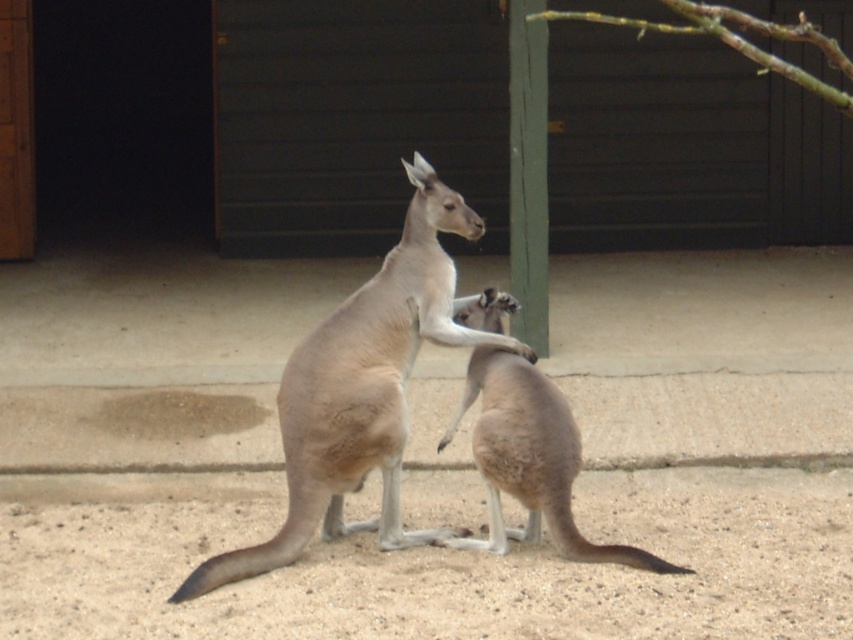
Question: Can you confirm if light brown fur at center is positioned to the right of green wood pole at center?

Choices:
 (A) yes
 (B) no

Answer: (B)

Question: Among these points, which one is nearest to the camera?

Choices:
 (A) (544, 51)
 (B) (287, 394)

Answer: (B)

Question: Considering the real-world distances, which object is closest to the light brown fur kangaroo at center?

Choices:
 (A) light brown fur at center
 (B) green wood pole at center

Answer: (A)

Question: Estimate the real-world distances between objects in this image. Which object is farther from the light brown fur kangaroo at center?

Choices:
 (A) light brown fur at center
 (B) green wood pole at center

Answer: (B)

Question: Can you confirm if light brown fur kangaroo at center is thinner than light brown fur at center?

Choices:
 (A) yes
 (B) no

Answer: (B)

Question: Can you confirm if light brown fur at center is positioned above green wood pole at center?

Choices:
 (A) yes
 (B) no

Answer: (B)